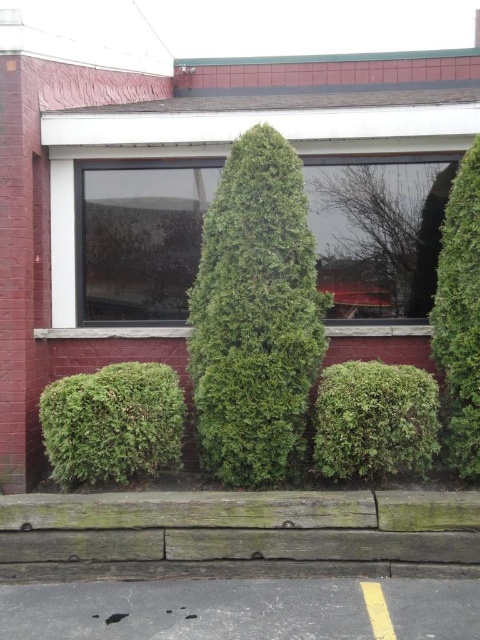
Between weathered wood curb at lower center and green leafy shrub at right, which one is positioned lower?

weathered wood curb at lower center is below.

Between point (374, 525) and point (455, 200), which one is positioned in front?

Point (374, 525) is in front.

Image resolution: width=480 pixels, height=640 pixels. Identify the location of weathered wood curb at lower center. click(x=239, y=532).

Can you confirm if transparent glass window at center is taller than green textured bush at lower left?

Indeed, transparent glass window at center has a greater height compared to green textured bush at lower left.

What do you see at coordinates (379, 232) in the screenshot?
I see `transparent glass window at center` at bounding box center [379, 232].

Is point (391, 292) positioned in front of point (45, 428)?

That is False.

The image size is (480, 640). Identify the location of transparent glass window at center. (379, 232).

Locate an element on the screen. Image resolution: width=480 pixels, height=640 pixels. weathered wood curb at lower center is located at coordinates (239, 532).

Is weathered wood curb at lower center taller than transparent glass window at center?

Incorrect, weathered wood curb at lower center's height is not larger of transparent glass window at center's.

Is point (396, 493) farther from camera compared to point (162, 180)?

That is False.

Where is `weathered wood curb at lower center`? The height and width of the screenshot is (640, 480). weathered wood curb at lower center is located at coordinates (239, 532).